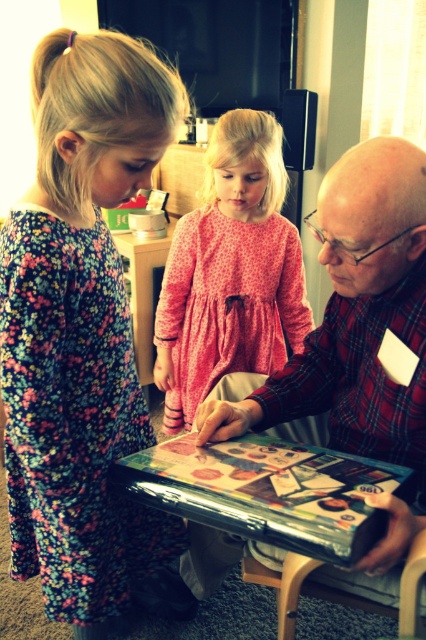
Question: Is floral dress at left below metallic/reflective table at center?

Choices:
 (A) yes
 (B) no

Answer: (B)

Question: Estimate the real-world distances between objects in this image. Which object is closer to the pink dotted dress at center?

Choices:
 (A) metallic/reflective table at center
 (B) floral dress at left

Answer: (B)

Question: Based on their relative distances, which object is nearer to the pink dotted dress at center?

Choices:
 (A) floral dress at left
 (B) metallic/reflective table at center

Answer: (A)

Question: Where is floral dress at left located in relation to pink dotted dress at center in the image?

Choices:
 (A) below
 (B) above

Answer: (A)

Question: Does pink dotted dress at center have a smaller size compared to metallic/reflective table at center?

Choices:
 (A) no
 (B) yes

Answer: (A)

Question: Among these points, which one is nearest to the camera?

Choices:
 (A) (37, 136)
 (B) (161, 493)

Answer: (A)